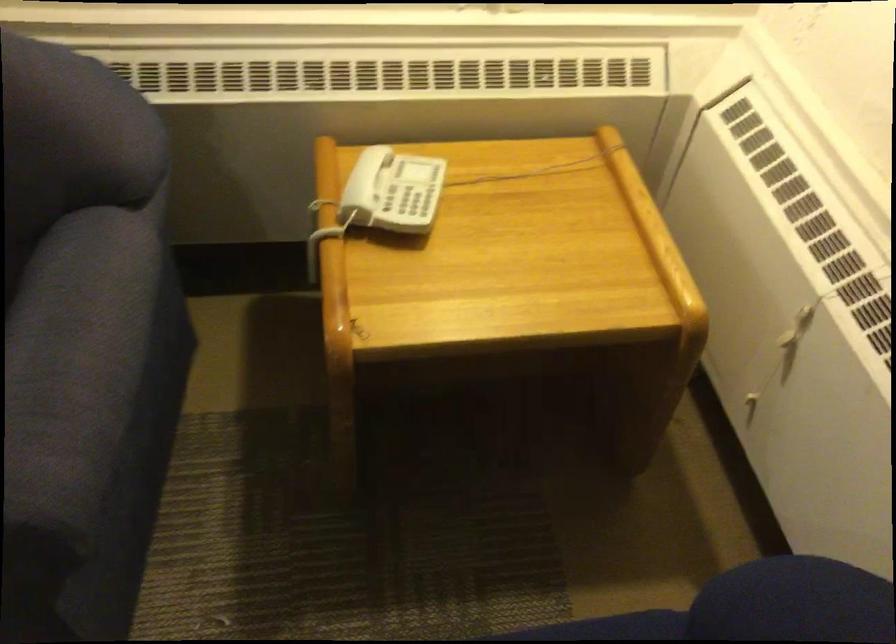
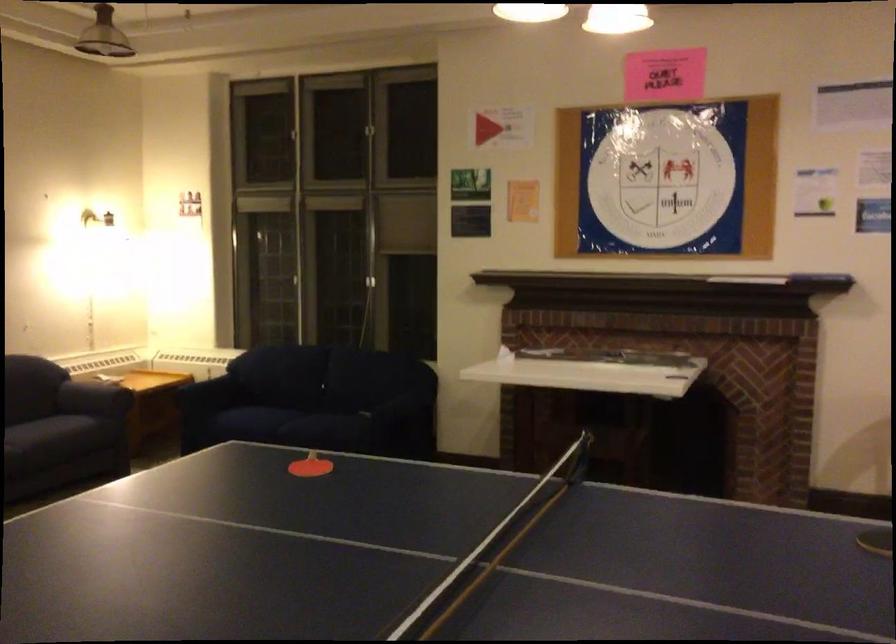
Question: I am providing you with two images of the same scene from different viewpoints. After the viewpoint changes to image2, which objects are now occluded?

Choices:
 (A) dark sofa sitting surface
 (B) white pet bowl
 (C) silver window handle
 (D) blue sofa armrest

Answer: (D)